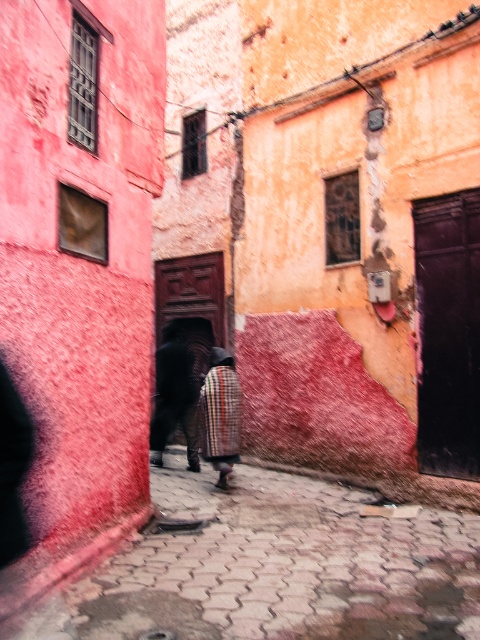
Question: Which point is farther to the camera?

Choices:
 (A) (215, 432)
 (B) (173, 424)

Answer: (B)

Question: Is dark brown leather pants at center smaller than plaid fabric coat at center?

Choices:
 (A) yes
 (B) no

Answer: (B)

Question: Does dark brown leather pants at center have a smaller size compared to plaid fabric coat at center?

Choices:
 (A) no
 (B) yes

Answer: (A)

Question: Which point is closer to the camera?

Choices:
 (A) plaid fabric coat at center
 (B) dark brown leather pants at center

Answer: (A)

Question: Does dark brown leather pants at center have a larger size compared to plaid fabric coat at center?

Choices:
 (A) yes
 (B) no

Answer: (A)